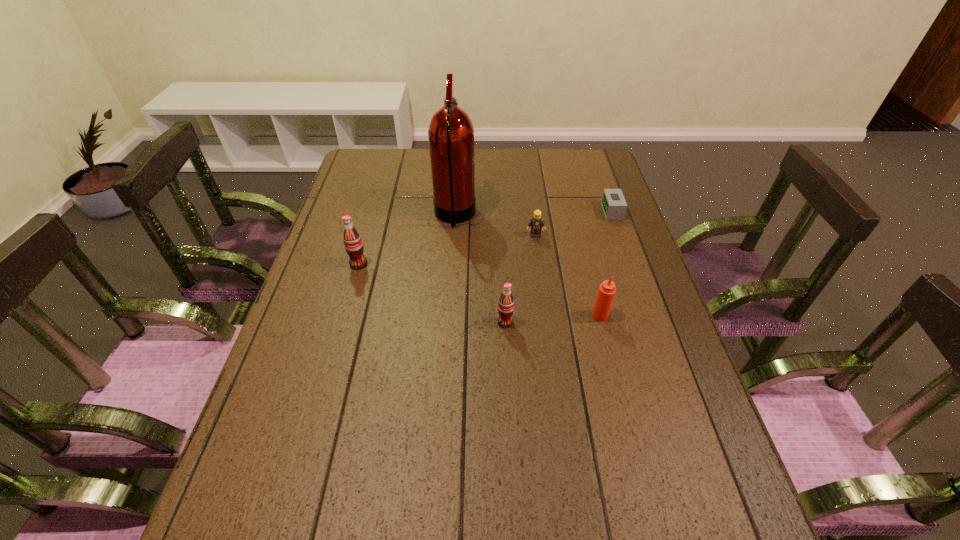
This screenshot has height=540, width=960. I want to click on the taller soda, so click(x=352, y=240).

You are a GUI agent. You are given a task and a screenshot of the screen. Output one action in this format:
    pyautogui.click(x=<x>, y=<y>)
    Task: Click on the farther soda
    
    Given the screenshot: What is the action you would take?
    pyautogui.click(x=352, y=240)

At what (x,y) coordinates should I click in order to perform the action: click on the shorter soda. Please return your answer as a coordinate pair (x, y). The height and width of the screenshot is (540, 960). Looking at the image, I should click on (506, 302).

Where is `the right soda`? The image size is (960, 540). the right soda is located at coordinates (506, 302).

Where is `the third object from right to left`? This screenshot has height=540, width=960. the third object from right to left is located at coordinates (536, 222).

Find the location of a particular element. Image resolution: width=960 pixels, height=540 pixels. the fifth tallest object is located at coordinates (536, 222).

The height and width of the screenshot is (540, 960). What are the coordinates of `the shortest object` in the screenshot? It's located at (613, 203).

The width and height of the screenshot is (960, 540). Find the location of `alarm clock`. alarm clock is located at coordinates (613, 203).

Where is `the second object from right to left`? This screenshot has width=960, height=540. the second object from right to left is located at coordinates (605, 296).

Identify the location of the tallest object. click(451, 133).